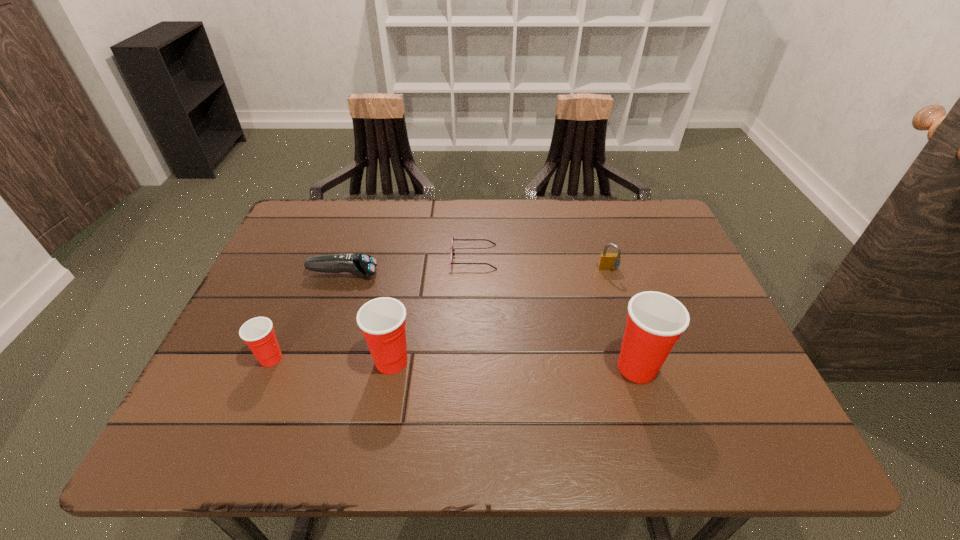
This screenshot has width=960, height=540. In order to click on free space located on the left of the rightmost Dixie cup in this screenshot , I will do `click(508, 367)`.

The height and width of the screenshot is (540, 960). Find the location of `vacant position located 0.130m on the side with the combination dials of the padlock`. vacant position located 0.130m on the side with the combination dials of the padlock is located at coordinates pos(622,312).

You are a GUI agent. You are given a task and a screenshot of the screen. Output one action in this format:
    pyautogui.click(x=<x>, y=<y>)
    Task: Click on the free space located on the head of the fifth tallest object
    
    Given the screenshot: What is the action you would take?
    pyautogui.click(x=504, y=274)

Find the location of a particular element. The image size is (960, 540). free location located 0.390m on the bridge of the sunglasses is located at coordinates (639, 257).

Identify the location of object that is at the far edge. The image size is (960, 540). (452, 250).

I want to click on Dixie cup present at the left edge, so click(258, 333).

Identify the location of electric shaver that is at the left edge. The image size is (960, 540). coord(362,265).

The width and height of the screenshot is (960, 540). I want to click on vacant space at the far edge of the desktop, so click(x=543, y=201).

At what (x,y) coordinates should I click in order to perform the action: click on vacant space at the near edge of the desktop. Please return your answer as a coordinate pair (x, y). This screenshot has width=960, height=540. Looking at the image, I should click on (421, 377).

What are the coordinates of `free spot at the left edge of the desktop` in the screenshot? It's located at (278, 302).